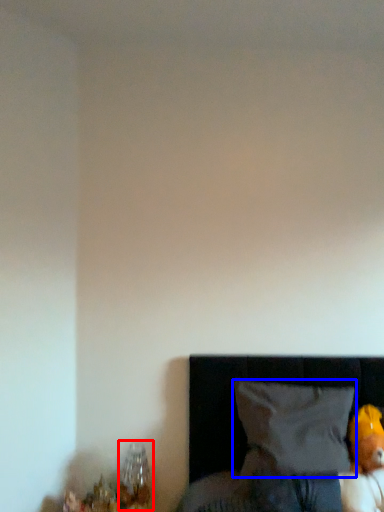
Question: Which object is further to the camera taking this photo, table lamp (highlighted by a red box) or pillow (highlighted by a blue box)?

Choices:
 (A) table lamp
 (B) pillow

Answer: (A)